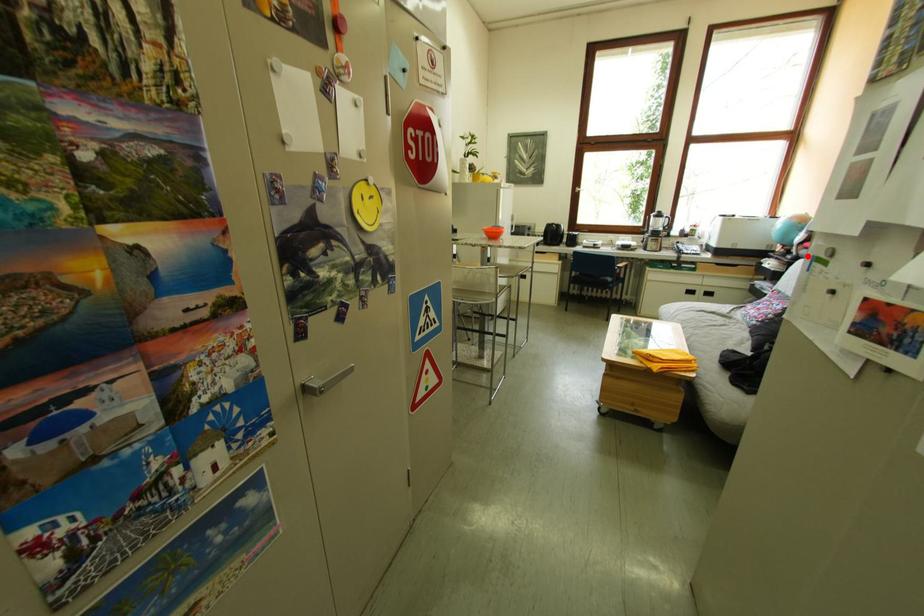
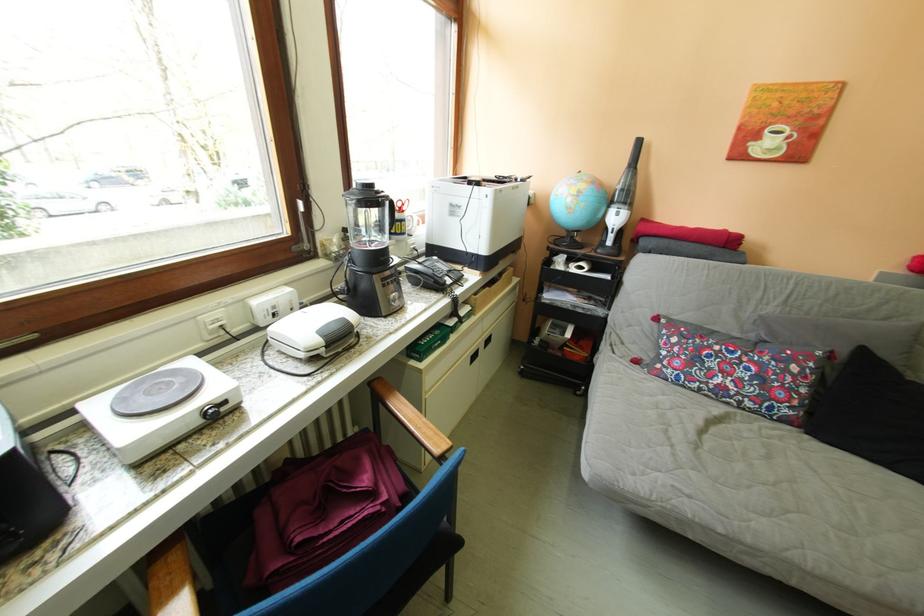
Question: I am providing you with two images of the same scene from different viewpoints. In image1, a red point is highlighted. Considering the same 3D point in image2, which of the following is correct?

Choices:
 (A) It is closer
 (B) It is farther

Answer: (A)